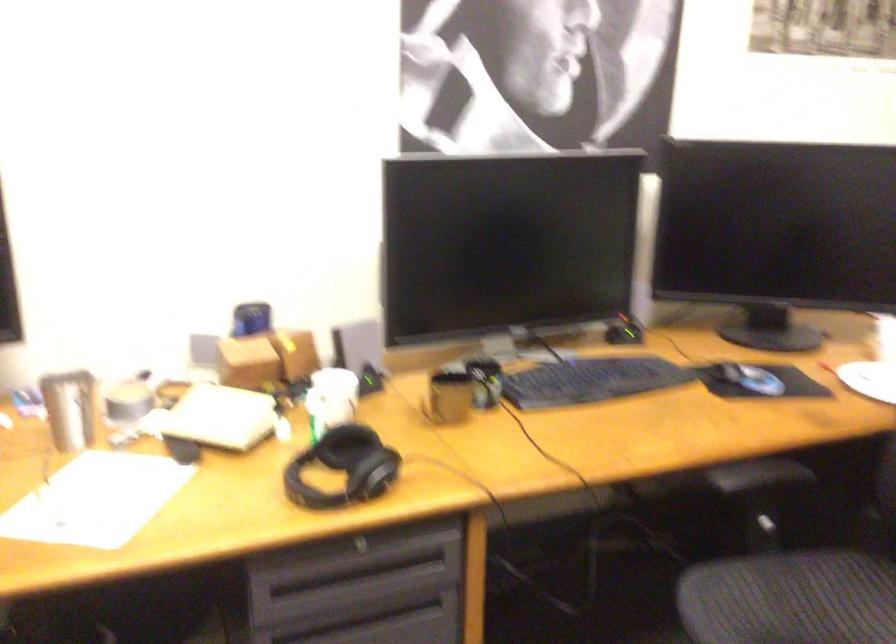
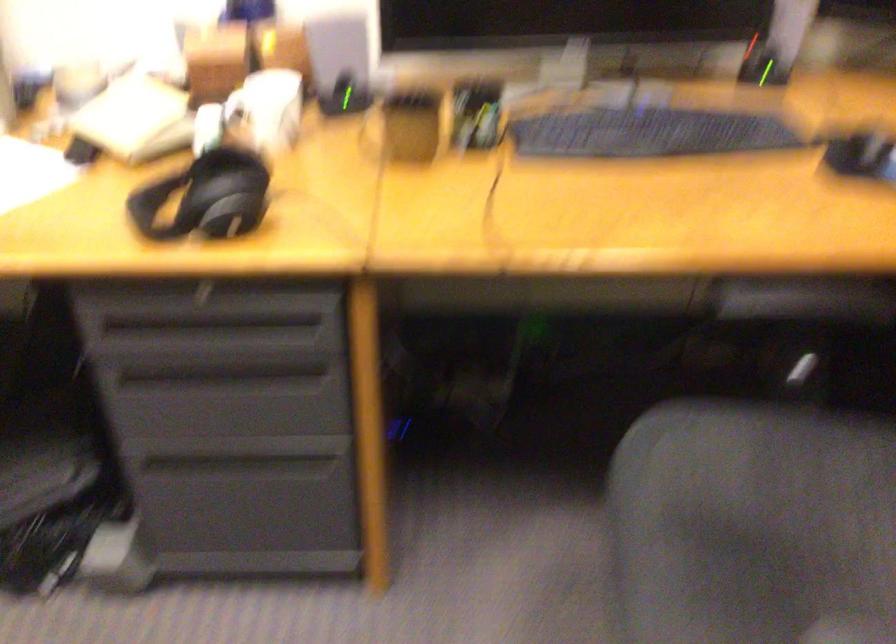
How did the camera likely rotate?

The camera rotated toward left-down.